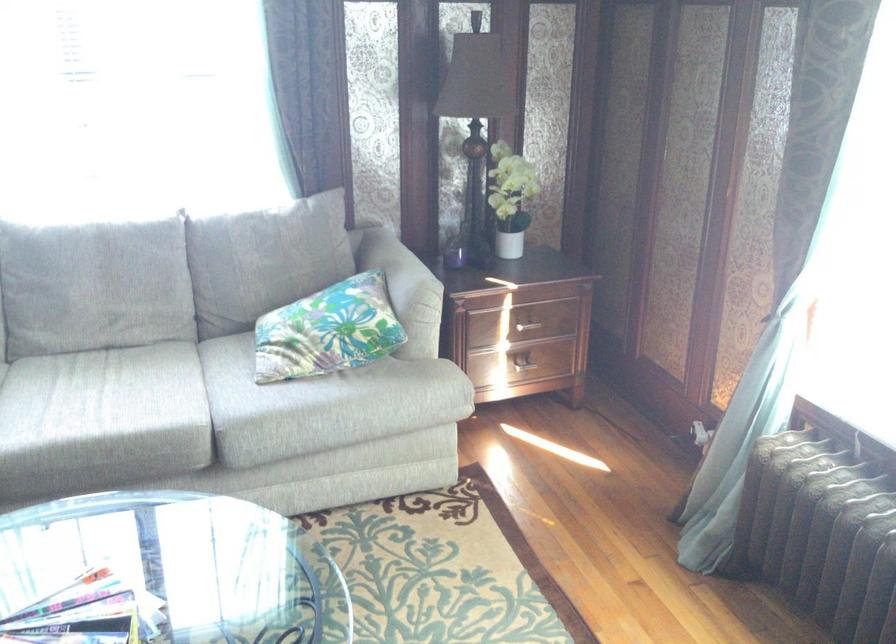
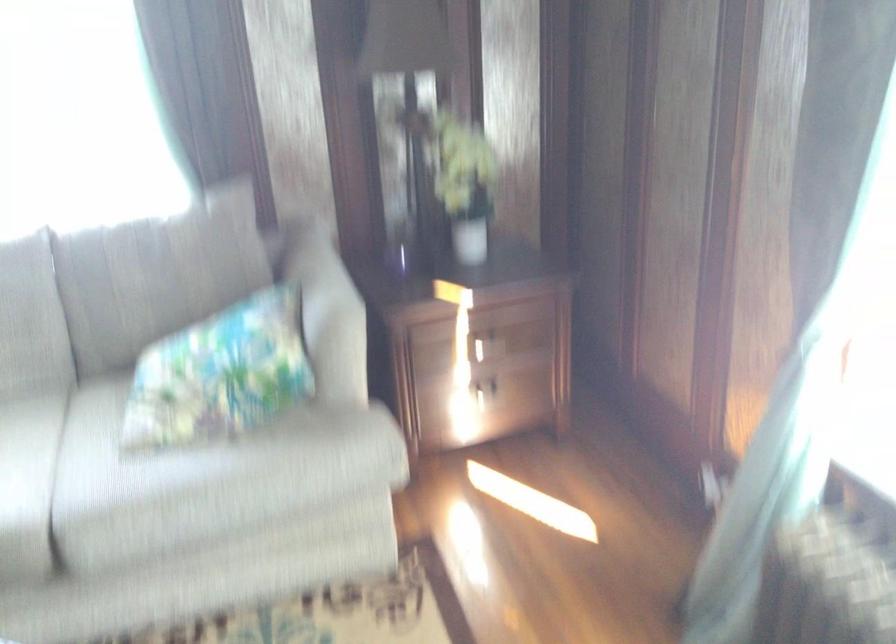
Where in the second image is the point corresponding to pixel 522 322 from the first image?

(487, 345)